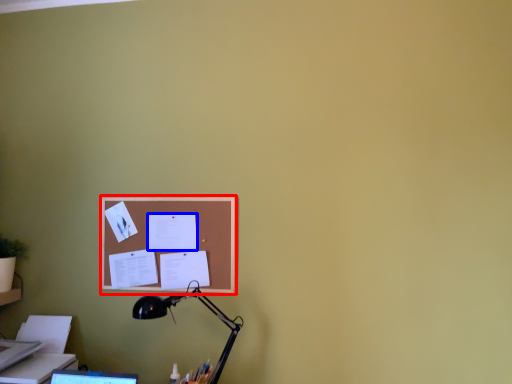
Question: Among these objects, which one is farthest to the camera, bulletin board (highlighted by a red box) or paper (highlighted by a blue box)?

Choices:
 (A) bulletin board
 (B) paper

Answer: (B)